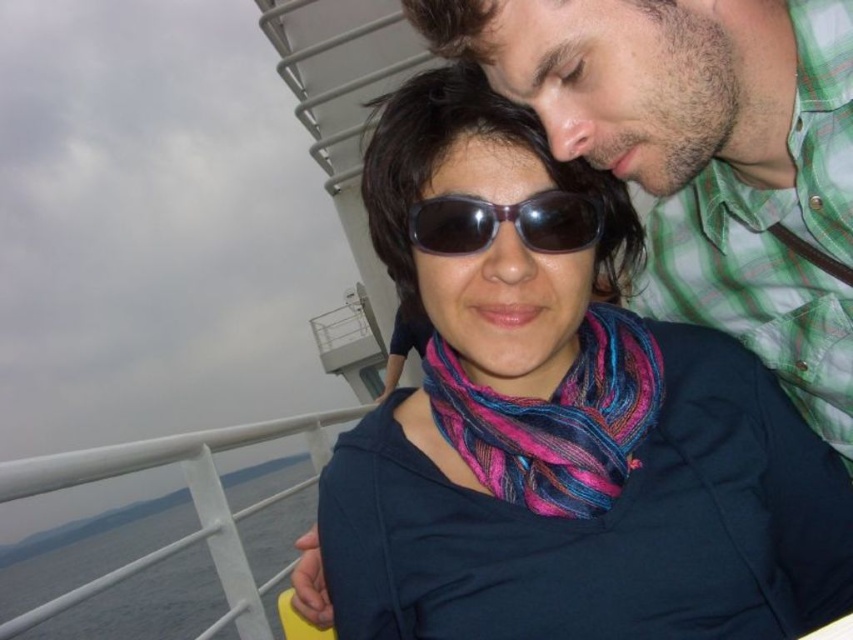
You are a photographer trying to capture both the multicolored woven scarf at center and the sunglasses at center in a single shot. However, you can only focus on one object at a time. Which object should you focus on to ensure the other remains in the background?

You should focus on the multicolored woven scarf at center because the sunglasses at center is behind it, so if you focus on the scarf, the sunglasses will naturally be in the background.

You are a photographer trying to capture the exact location of the matte black sunglasses at center in this scene. If the entire image is represented as a coordinate grid from 0 to 1 on both axes, where would you focus your camera to ensure the sunglasses are perfectly centered in your shot?

The matte black sunglasses at center is located at point coordinates of 0.673 on the x axis and 0.661 on the y axis. To center it, the camera should focus precisely at those coordinates.